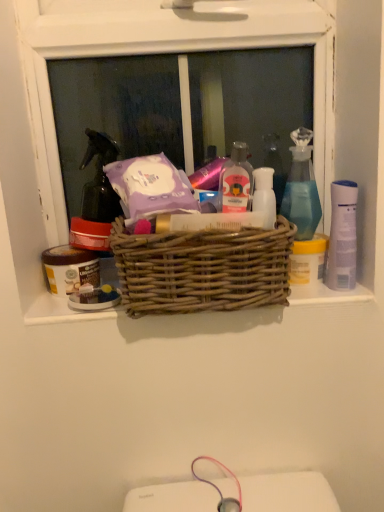
Question: From a real-world perspective, is white plastic mouthwash at right above or below white plastic bottle at center, acting as the third toiletry starting from the left?

Choices:
 (A) below
 (B) above

Answer: (A)

Question: Looking at the image, does white plastic mouthwash at right seem bigger or smaller compared to white plastic bottle at center, acting as the third toiletry starting from the left?

Choices:
 (A) small
 (B) big

Answer: (B)

Question: Considering the real-world distances, which object is farthest from the translucent plastic bottle at center, positioned as the second toiletry in left-to-right order?

Choices:
 (A) woven wood basket at center
 (B) white plastic bottle at center, marked as the 2th toiletry in a front-to-back arrangement
 (C) white plastic mouthwash at right
 (D) matte brown jar at left, acting as the first toiletry starting from the back
 (E) transparent glass door at upper center

Answer: (E)

Question: Which object is positioned farthest from the translucent glass spray bottle at upper right?

Choices:
 (A) white plastic mouthwash at right
 (B) white plastic bottle at center, marked as the 2th toiletry in a front-to-back arrangement
 (C) woven wood basket at center
 (D) matte brown jar at left, which is the 3th toiletry from front to back
 (E) transparent glass door at upper center

Answer: (E)